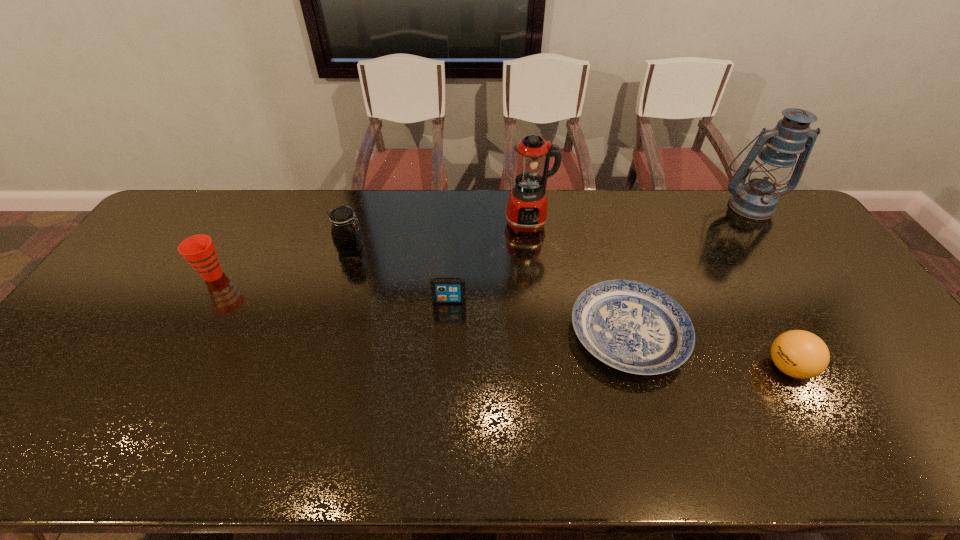
At what (x,y) coordinates should I click in order to perform the action: click on blank region between the rightmost object and the iPod. Please return your answer as a coordinate pair (x, y). The height and width of the screenshot is (540, 960). Looking at the image, I should click on (600, 253).

Image resolution: width=960 pixels, height=540 pixels. In order to click on vacant area between the fourth farthest object and the lantern in this screenshot , I will do `click(482, 240)`.

Locate an element on the screen. Image resolution: width=960 pixels, height=540 pixels. vacant space that's between the third farthest object and the iPod is located at coordinates (400, 274).

Find the location of `free area in between the second object from right to left and the fifth nearest object`. free area in between the second object from right to left and the fifth nearest object is located at coordinates (569, 307).

Identify the location of free area in between the ping-pong ball and the leftmost object. The image size is (960, 540). (501, 321).

The height and width of the screenshot is (540, 960). Identify the location of object that ranks as the second closest to the lantern. (801, 354).

At what (x,y) coordinates should I click in order to perform the action: click on object identified as the closest to the lantern. Please return your answer as a coordinate pair (x, y). Looking at the image, I should click on (631, 326).

Where is `blank space that satisfies the following two spatial constraints: 1. on the front-facing side of the lantern; 2. on the side with brand of the second object from right to left`? The width and height of the screenshot is (960, 540). blank space that satisfies the following two spatial constraints: 1. on the front-facing side of the lantern; 2. on the side with brand of the second object from right to left is located at coordinates (864, 367).

The width and height of the screenshot is (960, 540). I want to click on free space that satisfies the following two spatial constraints: 1. on the controls of the food processor; 2. on the lid of the jar, so click(531, 247).

Find the location of a particular element. free point that satisfies the following two spatial constraints: 1. on the back side of the shortest object; 2. on the lid of the fifth nearest object is located at coordinates (604, 247).